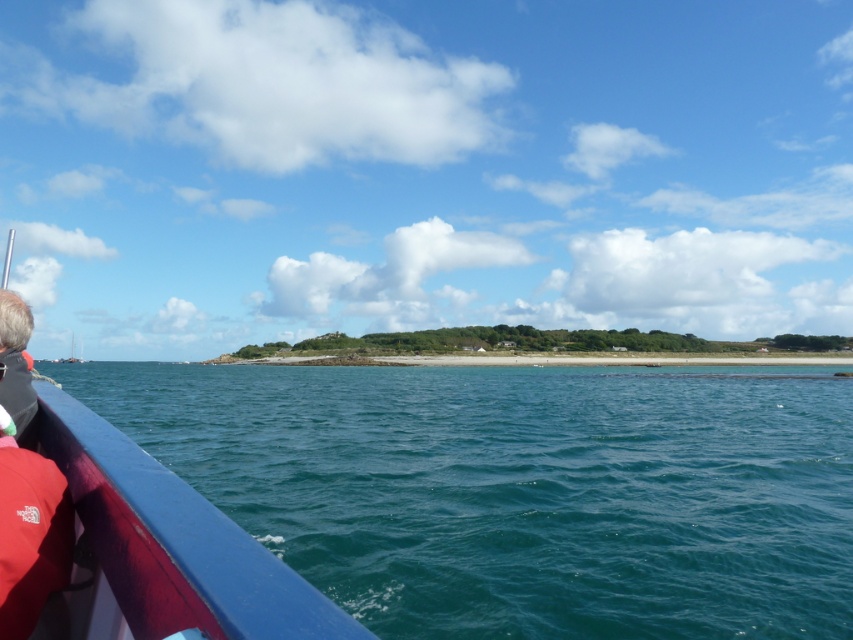
Does red fabric life jacket at lower left appear over gray fabric at left?

Incorrect, red fabric life jacket at lower left is not positioned above gray fabric at left.

Can you confirm if red fabric life jacket at lower left is bigger than gray fabric at left?

No, red fabric life jacket at lower left is not bigger than gray fabric at left.

Which is behind, point (6, 467) or point (10, 394)?

The point (10, 394) is more distant.

Identify the location of red fabric life jacket at lower left. (30, 536).

Is point (91, 563) farther from camera compared to point (39, 541)?

Yes.

Locate an element on the screen. This screenshot has width=853, height=640. smooth blue boat at left is located at coordinates (169, 545).

From the picture: Is deep blue water at lower left in front of gray fabric at left?

No, deep blue water at lower left is further to the viewer.

Between point (184, 364) and point (7, 310), which one is positioned behind?

Point (184, 364)

Measure the distance between point (428, 612) and camera.

Point (428, 612) and camera are 21.37 feet apart from each other.

This screenshot has height=640, width=853. In order to click on deep blue water at lower left in this screenshot , I will do `click(521, 490)`.